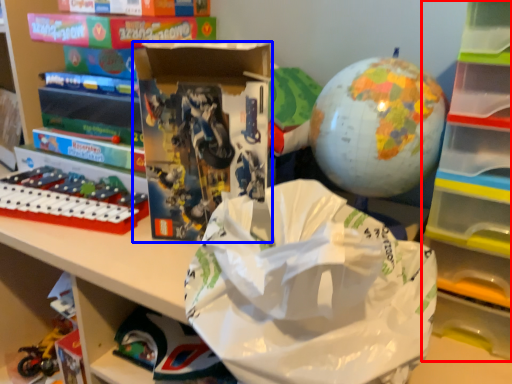
Question: Which point is closer to the camera, bookshelf (highlighted by a red box) or book (highlighted by a blue box)?

Choices:
 (A) bookshelf
 (B) book

Answer: (A)